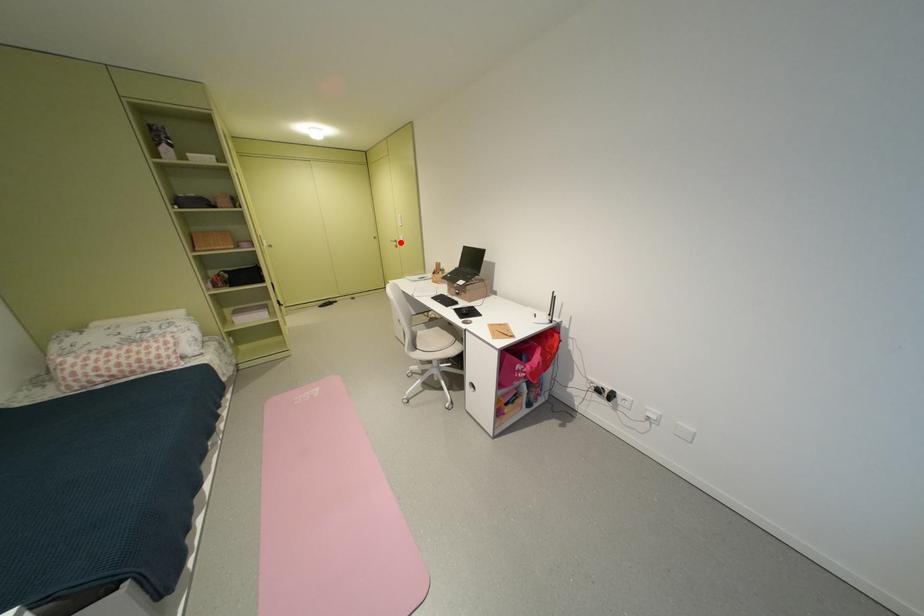
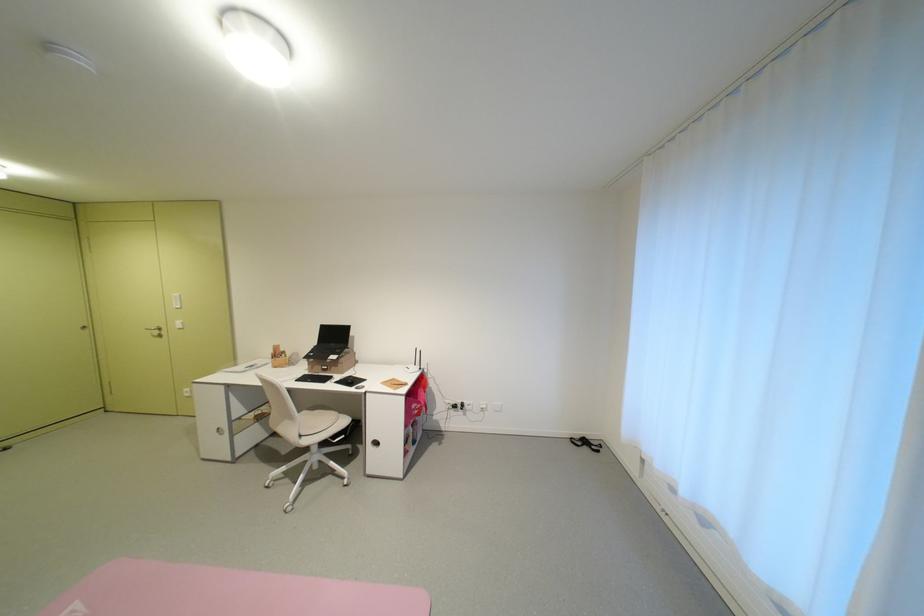
Question: I am providing you with two images of the same scene from different viewpoints. Given a red point in image1, look at the same physical point in image2. Is it:

Choices:
 (A) Closer to the viewpoint
 (B) Farther from the viewpoint

Answer: (B)